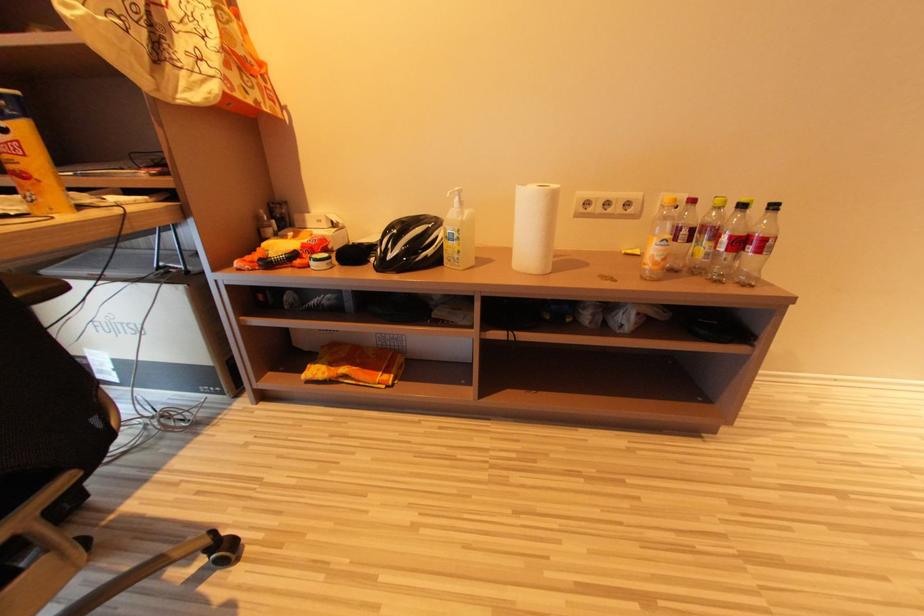
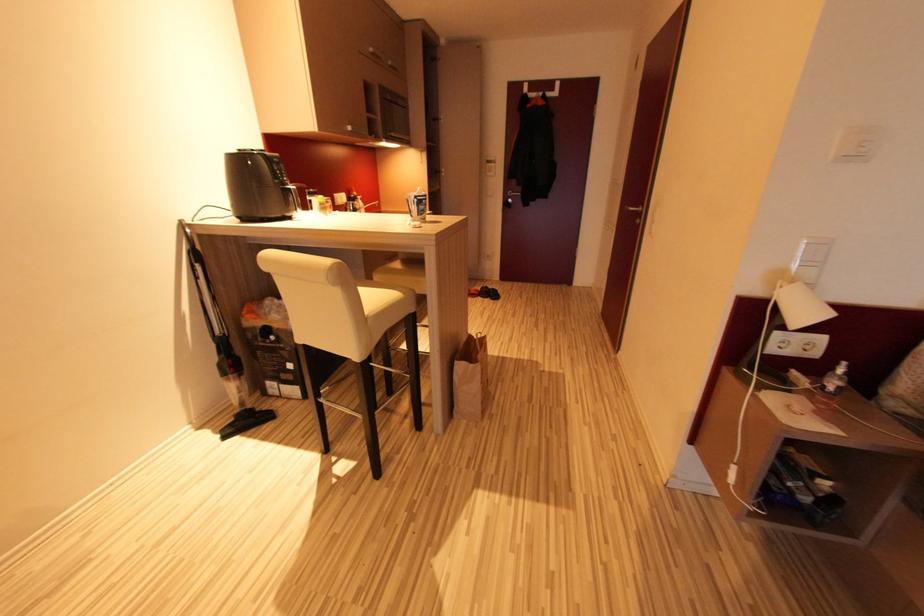
The images are taken continuously from a first-person perspective. In which direction is your viewpoint rotating?

The camera rotated toward right-down.